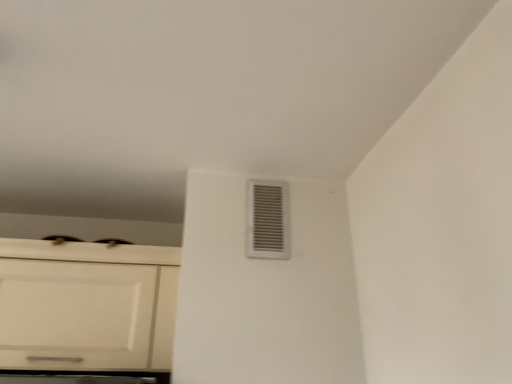
You are a GUI agent. You are given a task and a screenshot of the screen. Output one action in this format:
    pyautogui.click(x=<x>, y=<y>)
    Task: Click on the white matte vent at upper center
    The height and width of the screenshot is (384, 512).
    Given the screenshot: What is the action you would take?
    pyautogui.click(x=267, y=220)

The width and height of the screenshot is (512, 384). What do you see at coordinates (267, 220) in the screenshot?
I see `white matte vent at upper center` at bounding box center [267, 220].

Image resolution: width=512 pixels, height=384 pixels. What are the coordinates of `white matte vent at upper center` in the screenshot? It's located at (267, 220).